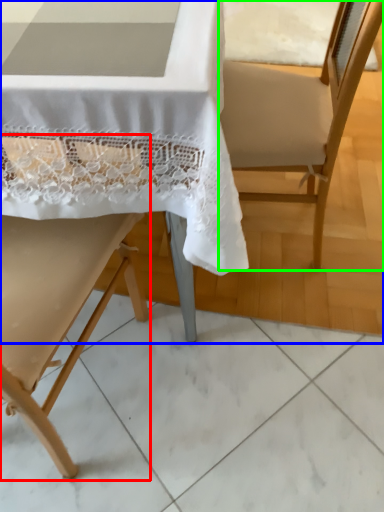
Question: Which object is positioned farthest from chair (highlighted by a red box)? Select from chair (highlighted by a blue box) and armchair (highlighted by a green box).

Choices:
 (A) chair
 (B) armchair

Answer: (B)